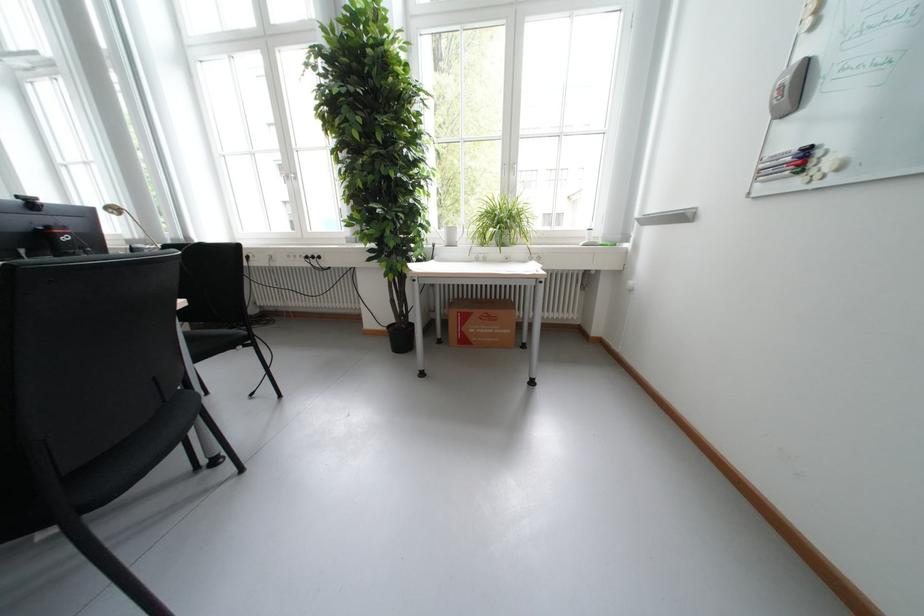
Locate an element on the screen. This screenshot has height=616, width=924. brown cardboard box is located at coordinates (481, 323).